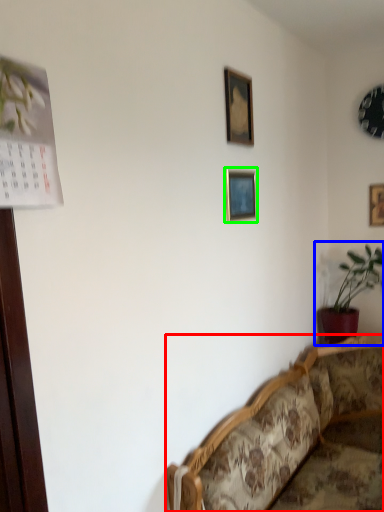
Question: Estimate the real-world distances between objects in this image. Which object is farther from studio couch (highlighted by a red box), houseplant (highlighted by a blue box) or picture frame (highlighted by a green box)?

Choices:
 (A) houseplant
 (B) picture frame

Answer: (B)